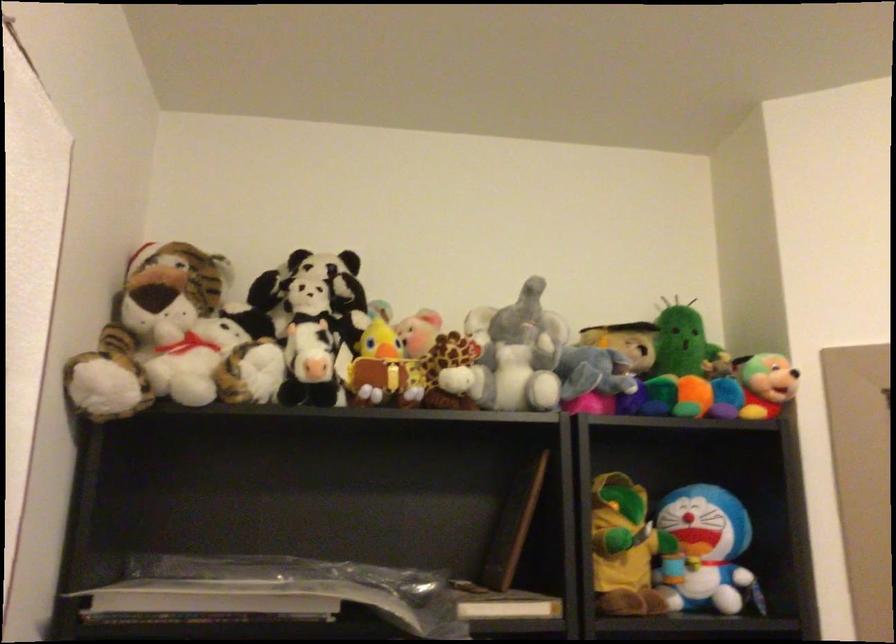
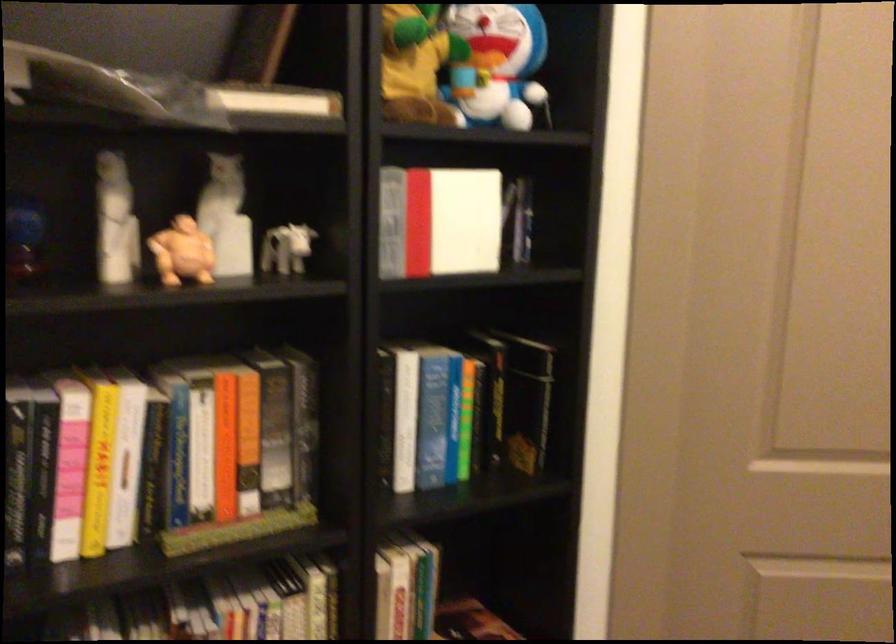
From the picture: The first image is from the beginning of the video and the second image is from the end. How did the camera likely rotate when shooting the video?

The camera rotated toward right-down.